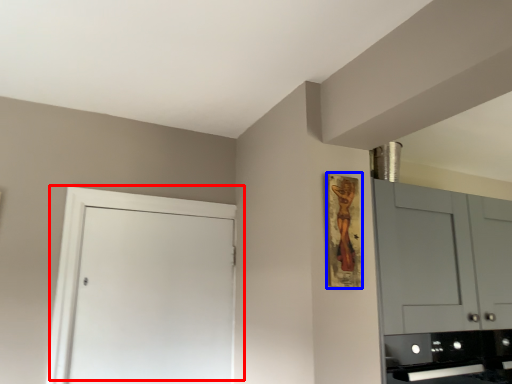
Question: Which object appears closest to the camera in this image, door (highlighted by a red box) or picture frame (highlighted by a blue box)?

Choices:
 (A) door
 (B) picture frame

Answer: (B)